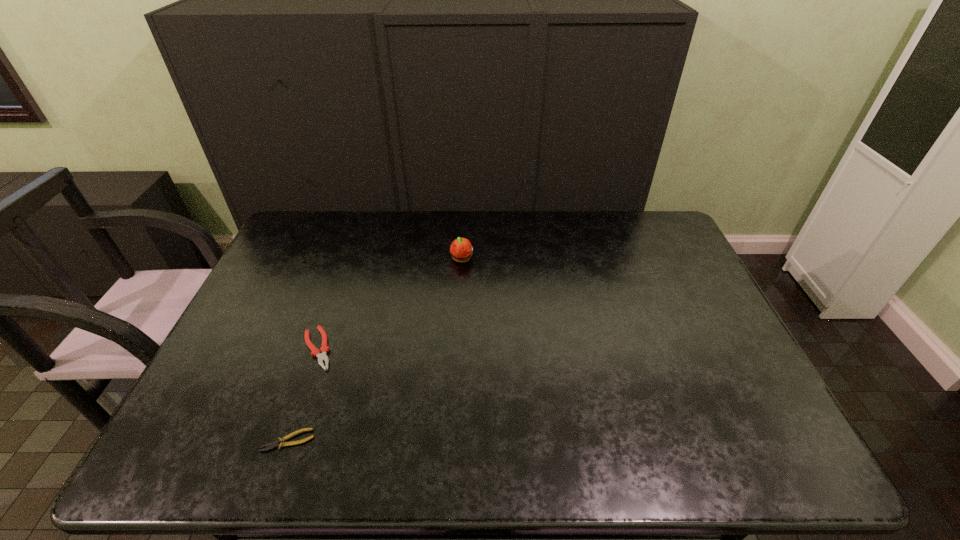
Where is `vacant space at the far edge of the desktop`? Image resolution: width=960 pixels, height=540 pixels. vacant space at the far edge of the desktop is located at coordinates (428, 212).

Where is `vacant space at the near edge of the desktop`? The height and width of the screenshot is (540, 960). vacant space at the near edge of the desktop is located at coordinates (697, 450).

Where is `free space at the left edge of the desktop`? This screenshot has height=540, width=960. free space at the left edge of the desktop is located at coordinates (274, 372).

Locate an element on the screen. Image resolution: width=960 pixels, height=540 pixels. vacant space at the right edge of the desktop is located at coordinates (755, 406).

This screenshot has width=960, height=540. In order to click on vacant space at the far right corner in this screenshot , I will do `click(670, 225)`.

Identify the location of empty space that is in between the second shortest object and the tallest object. Image resolution: width=960 pixels, height=540 pixels. (x=390, y=304).

Find the location of a particular element. empty space that is in between the second tallest object and the shortest object is located at coordinates (303, 395).

The height and width of the screenshot is (540, 960). I want to click on vacant area that lies between the second shortest object and the shorter pliers, so click(x=303, y=395).

Locate an element on the screen. The width and height of the screenshot is (960, 540). free spot between the second tallest object and the shortest object is located at coordinates (303, 395).

What are the coordinates of `empty location between the farther pliers and the nearer pliers` in the screenshot? It's located at (303, 395).